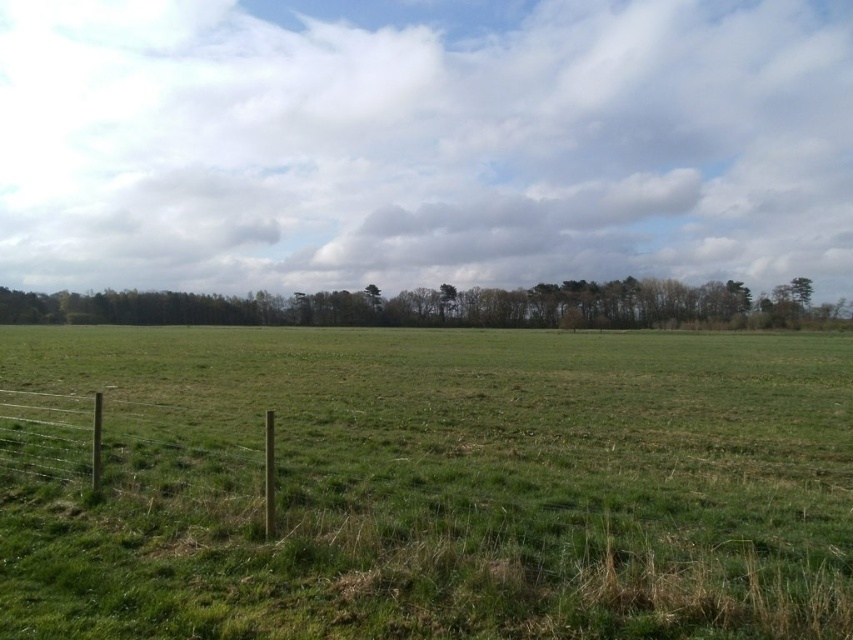
Question: Does green grass pasture at center appear on the right side of brown wooden fence at lower left?

Choices:
 (A) yes
 (B) no

Answer: (A)

Question: Estimate the real-world distances between objects in this image. Which object is closer to the green leafy trees at upper center?

Choices:
 (A) green grass pasture at center
 (B) brown wooden fence at lower left

Answer: (A)

Question: Can you confirm if green grass pasture at center is positioned below brown wooden fence at lower left?

Choices:
 (A) no
 (B) yes

Answer: (A)

Question: Considering the real-world distances, which object is farthest from the brown wooden fence at lower left?

Choices:
 (A) green grass pasture at center
 (B) green leafy trees at upper center

Answer: (B)

Question: Does green leafy trees at upper center have a greater width compared to brown wooden fence at lower left?

Choices:
 (A) no
 (B) yes

Answer: (B)

Question: Considering the real-world distances, which object is farthest from the green grass pasture at center?

Choices:
 (A) green leafy trees at upper center
 (B) brown wooden fence at lower left

Answer: (A)